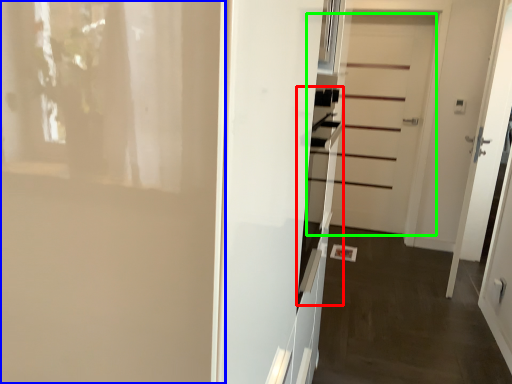
Question: Which object is positioned farthest from oven (highlighted by a red box)? Select from door (highlighted by a blue box) and door (highlighted by a green box).

Choices:
 (A) door
 (B) door

Answer: (B)